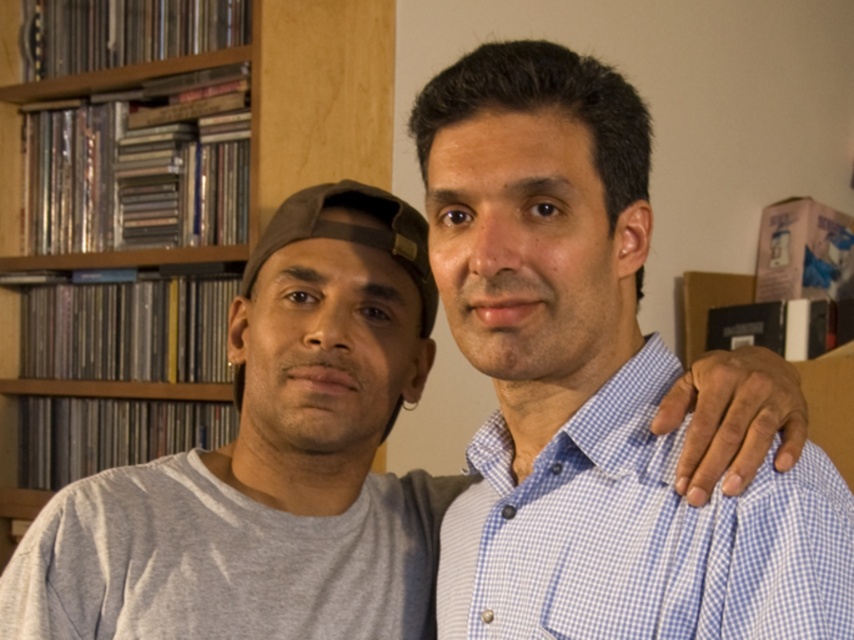
Question: Which point appears closest to the camera in this image?

Choices:
 (A) (761, 580)
 (B) (57, 499)
 (C) (284, 136)

Answer: (A)

Question: Is gray cotton t-shirt at center positioned at the back of blue checkered shirt at right?

Choices:
 (A) no
 (B) yes

Answer: (B)

Question: Among these points, which one is nearest to the camera?

Choices:
 (A) (747, 540)
 (B) (619, 397)
 (C) (355, 163)

Answer: (A)

Question: Does gray cotton t-shirt at center have a smaller size compared to blue checkered shirt at right?

Choices:
 (A) no
 (B) yes

Answer: (A)

Question: Considering the relative positions of blue checkered shirt at right and wooden bookshelf at upper left in the image provided, where is blue checkered shirt at right located with respect to wooden bookshelf at upper left?

Choices:
 (A) below
 (B) above

Answer: (A)

Question: Which of the following is the farthest from the observer?

Choices:
 (A) (483, 515)
 (B) (167, 628)

Answer: (B)